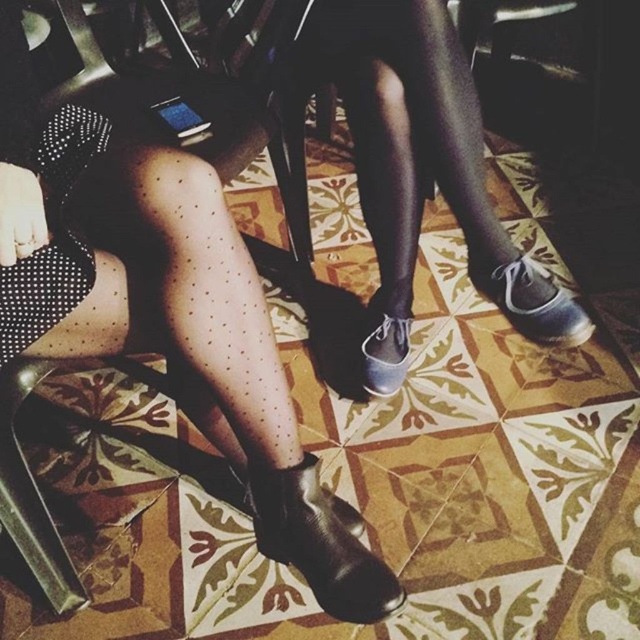
Image resolution: width=640 pixels, height=640 pixels. I want to click on matte black shoe at lower center, so click(385, 211).

Is point (387, 125) farther from camera compared to point (13, 353)?

Yes, it is behind point (13, 353).

Find the location of a particular element. The width and height of the screenshot is (640, 640). matte black shoe at lower center is located at coordinates (385, 211).

Who is positioned more to the left, black leather boot at lower center or black dotted tights at lower left?

black dotted tights at lower left is more to the left.

In the scene shown: Does black leather boot at lower center have a lesser width compared to black dotted tights at lower left?

No.

Is point (268, 515) positioned behind point (83, 124)?

Yes, point (268, 515) is behind point (83, 124).

The width and height of the screenshot is (640, 640). What are the coordinates of `black leather boot at lower center` in the screenshot? It's located at (321, 541).

Who is positioned more to the right, matte black tights at center or white leather shoe at lower right?

From the viewer's perspective, white leather shoe at lower right appears more on the right side.

Does matte black tights at center have a greater height compared to white leather shoe at lower right?

Indeed, matte black tights at center has a greater height compared to white leather shoe at lower right.

Locate an element on the screen. matte black tights at center is located at coordinates (422, 154).